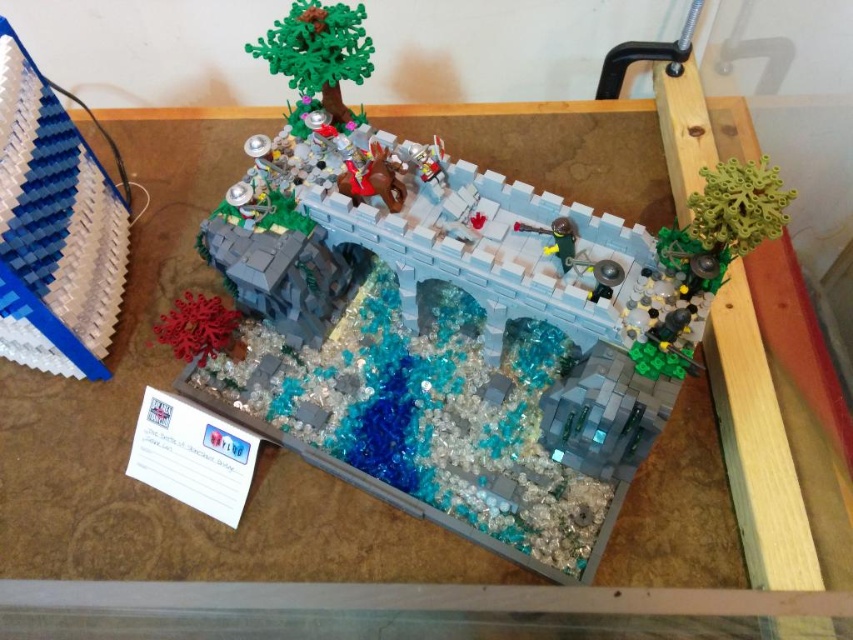
You are setting up a display and want to know if the blue matte foam at left can fit into a space that is the same size as the green matte tree at upper center. Can it fit?

The blue matte foam at left has a width less than the green matte tree at upper center, so it can fit into a space of the same size as the green matte tree at upper center.

You are a tiny explorer standing on the wooden surface in the LEGO diorama. You see the blue matte foam at left and the green matte tree at upper center. Which object is closer to the ground?

The blue matte foam at left is located below the green matte tree at upper center, so it is closer to the ground.

You are a small LEGO figure standing on the wooden surface. You want to climb onto the higher object between the blue matte foam at left and the green matte tree at upper center. Which one should you choose?

The blue matte foam at left has a greater height compared to the green matte tree at upper center, so you should choose the blue matte foam at left to climb onto.